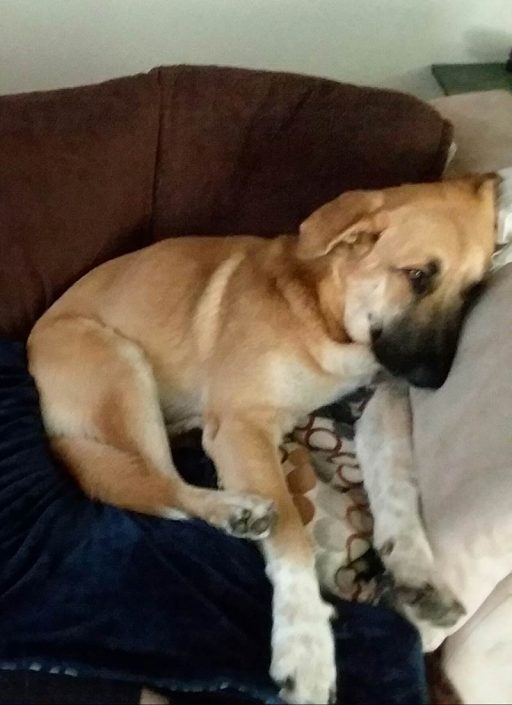
I want to click on dark blue cushion, so click(177, 620).